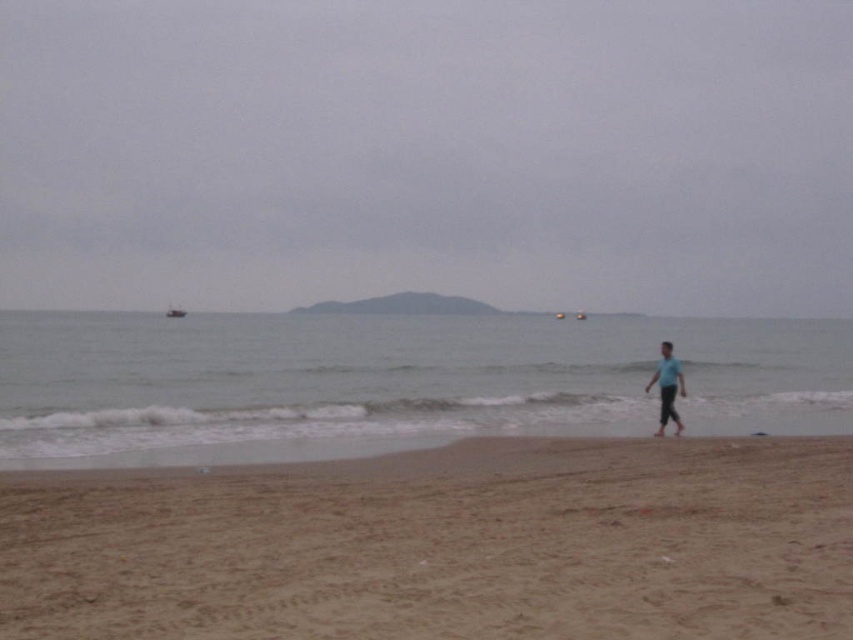
Does brown sandy beach at lower center have a lesser width compared to gray matte water at center?

Indeed, brown sandy beach at lower center has a lesser width compared to gray matte water at center.

Who is more forward, (74, 544) or (611, 419)?

Positioned in front is point (74, 544).

You are a GUI agent. You are given a task and a screenshot of the screen. Output one action in this format:
    pyautogui.click(x=<x>, y=<y>)
    Task: Click on the brown sandy beach at lower center
    The width and height of the screenshot is (853, 640).
    Given the screenshot: What is the action you would take?
    pyautogui.click(x=444, y=545)

Is point (488, 77) in front of point (637, 570)?

No, (488, 77) is behind (637, 570).

Does gray matte sky at upper center appear on the left side of brown sandy beach at lower center?

Correct, you'll find gray matte sky at upper center to the left of brown sandy beach at lower center.

The width and height of the screenshot is (853, 640). Find the location of `gray matte sky at upper center`. gray matte sky at upper center is located at coordinates (427, 152).

Where is `gray matte sky at upper center`? The width and height of the screenshot is (853, 640). gray matte sky at upper center is located at coordinates (427, 152).

Is brown sandy beach at lower center to the right of blue cotton shirt at lower right from the viewer's perspective?

In fact, brown sandy beach at lower center is to the left of blue cotton shirt at lower right.

Describe the element at coordinates (444, 545) in the screenshot. The height and width of the screenshot is (640, 853). I see `brown sandy beach at lower center` at that location.

Locate an element on the screen. brown sandy beach at lower center is located at coordinates (444, 545).